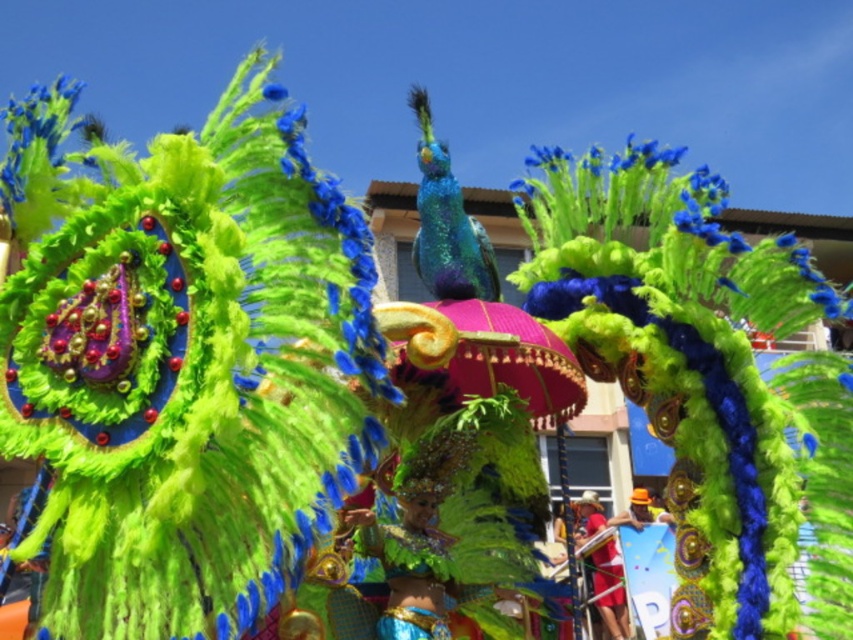
Can you confirm if shiny green costume at center is thinner than shiny metallic helmet at center?

Yes.

Locate an element on the screen. The height and width of the screenshot is (640, 853). shiny green costume at center is located at coordinates (410, 564).

The width and height of the screenshot is (853, 640). Describe the element at coordinates (410, 564) in the screenshot. I see `shiny green costume at center` at that location.

Based on the photo, who is more distant from viewer, (384,563) or (601,611)?

The point (601,611) is more distant.

Which is in front, point (437, 529) or point (613, 548)?

Point (437, 529) is in front.

The image size is (853, 640). Find the location of `shiny green costume at center`. shiny green costume at center is located at coordinates (410, 564).

Can you confirm if pink satin umbrella at center is smaller than shiny metallic helmet at center?

Actually, pink satin umbrella at center might be larger than shiny metallic helmet at center.

Can you confirm if pink satin umbrella at center is taller than shiny metallic helmet at center?

No.

Between point (491, 314) and point (584, 516), which one is positioned in front?

Point (491, 314) is more forward.

At what (x,y) coordinates should I click in order to perform the action: click on pink satin umbrella at center. Please return your answer as a coordinate pair (x, y). Looking at the image, I should click on (488, 353).